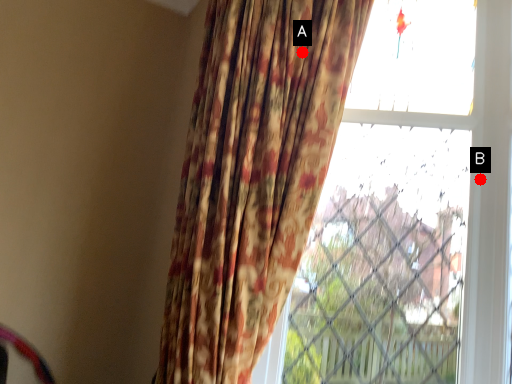
Question: Two points are circled on the image, labeled by A and B beside each circle. Among these points, which one is nearest to the camera?

Choices:
 (A) A is closer
 (B) B is closer

Answer: (A)